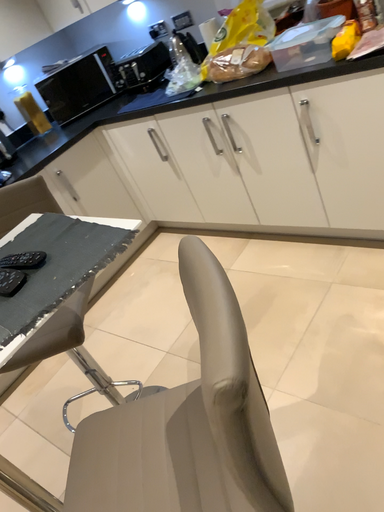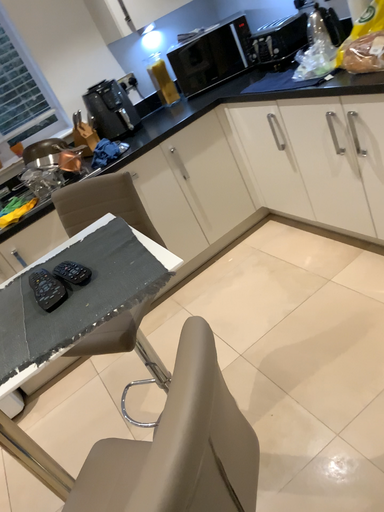
Question: How did the camera likely rotate when shooting the video?

Choices:
 (A) rotated right
 (B) rotated left

Answer: (B)